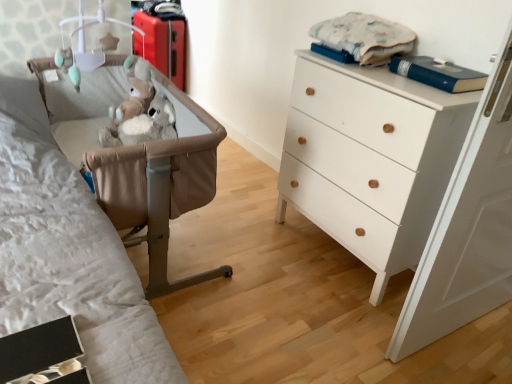
Question: Is white wood chest of drawers at right facing towards matte red suitcase at upper left?

Choices:
 (A) no
 (B) yes

Answer: (A)

Question: Is white wood chest of drawers at right behind matte red suitcase at upper left?

Choices:
 (A) no
 (B) yes

Answer: (A)

Question: Can you confirm if white wood chest of drawers at right is taller than matte red suitcase at upper left?

Choices:
 (A) yes
 (B) no

Answer: (A)

Question: From a real-world perspective, is white wood chest of drawers at right positioned under matte red suitcase at upper left based on gravity?

Choices:
 (A) yes
 (B) no

Answer: (B)

Question: Does white wood chest of drawers at right have a larger size compared to matte red suitcase at upper left?

Choices:
 (A) yes
 (B) no

Answer: (A)

Question: Is white wood chest of drawers at right to the right of matte red suitcase at upper left from the viewer's perspective?

Choices:
 (A) yes
 (B) no

Answer: (A)

Question: Is matte red suitcase at upper left in contact with blue hardcover book at upper right?

Choices:
 (A) yes
 (B) no

Answer: (B)

Question: Is matte red suitcase at upper left completely or partially outside of blue hardcover book at upper right?

Choices:
 (A) yes
 (B) no

Answer: (A)

Question: From the image's perspective, would you say matte red suitcase at upper left is shown under blue hardcover book at upper right?

Choices:
 (A) yes
 (B) no

Answer: (B)

Question: Can blue hardcover book at upper right be found inside matte red suitcase at upper left?

Choices:
 (A) yes
 (B) no

Answer: (B)

Question: Is matte red suitcase at upper left turned away from blue hardcover book at upper right?

Choices:
 (A) yes
 (B) no

Answer: (B)

Question: From a real-world perspective, is matte red suitcase at upper left under blue hardcover book at upper right?

Choices:
 (A) no
 (B) yes

Answer: (B)

Question: Is white plastic mobile at upper left at the back of tan leather crib at left?

Choices:
 (A) no
 (B) yes

Answer: (A)